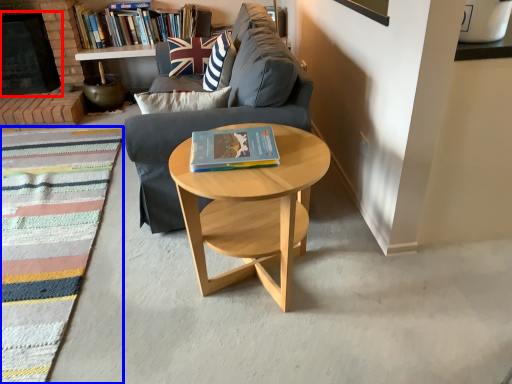
Question: Which of the following is the closest to the observer, fireplace (highlighted by a red box) or mat (highlighted by a blue box)?

Choices:
 (A) fireplace
 (B) mat

Answer: (B)